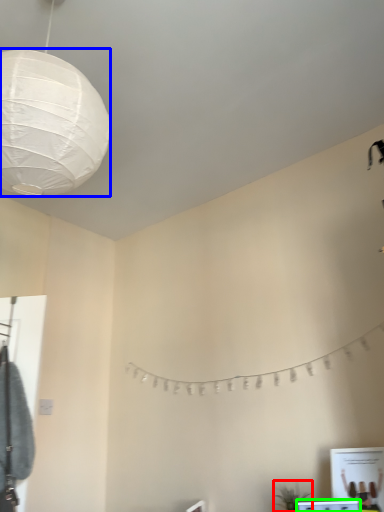
Question: Which object is positioned closest to plant (highlighted by a red box)? Select from lantern (highlighted by a blue box) and vanity (highlighted by a green box).

Choices:
 (A) lantern
 (B) vanity

Answer: (B)